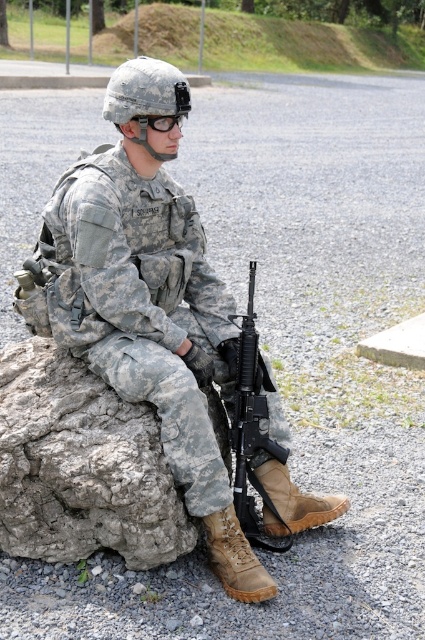
Question: Does camouflage uniform at center have a greater width compared to gray rough rock at lower left?

Choices:
 (A) yes
 (B) no

Answer: (A)

Question: Which object is positioned closest to the gray rough rock at lower left?

Choices:
 (A) black matte/glossy goggles at upper center
 (B) black matte rifle at lower center

Answer: (B)

Question: Which point is farther to the camera?

Choices:
 (A) gray rough rock at lower left
 (B) black matte/glossy goggles at upper center

Answer: (B)

Question: Can you confirm if camouflage uniform at center is wider than gray rough rock at lower left?

Choices:
 (A) yes
 (B) no

Answer: (A)

Question: Among these objects, which one is nearest to the camera?

Choices:
 (A) camouflage uniform at center
 (B) gray rough rock at lower left
 (C) black matte/glossy goggles at upper center

Answer: (B)

Question: Can you confirm if camouflage uniform at center is positioned to the right of black matte/glossy goggles at upper center?

Choices:
 (A) no
 (B) yes

Answer: (A)